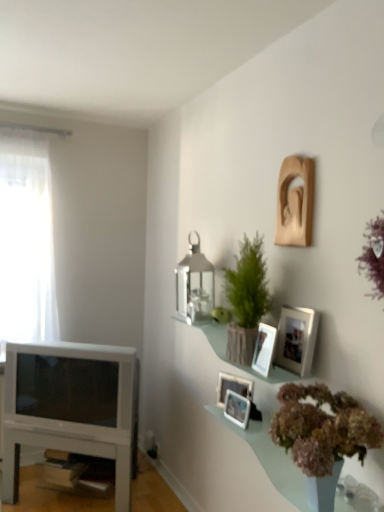
Question: Considering the relative positions of white glossy television at left and wooden sculpture at upper right, the 1th picture frame in the top-to-bottom sequence, in the image provided, is white glossy television at left to the left or to the right of wooden sculpture at upper right, the 1th picture frame in the top-to-bottom sequence,?

Choices:
 (A) right
 (B) left

Answer: (B)

Question: In the image, is white glossy television at left positioned in front of or behind wooden sculpture at upper right, which is the 5th picture frame in bottom-to-top order?

Choices:
 (A) behind
 (B) front

Answer: (A)

Question: Estimate the real-world distances between objects in this image. Which object is closer to the matte silver picture frame at center, positioned as the 5th picture frame in top-to-bottom order?

Choices:
 (A) green textured plant at upper center, the 2th houseplant from the front
 (B) matte silver picture frame at center, which is counted as the second picture frame, starting from the bottom
 (C) matte glass shelf at upper right
 (D) wooden photo frame at upper right, the second picture frame in the top-to-bottom sequence
 (E) white glossy table at lower left

Answer: (B)

Question: Which object is the closest to the matte glass shelf at upper right?

Choices:
 (A) silver metallic lantern at upper center
 (B) white glossy television at left
 (C) matte silver picture frame at center, marked as the 1th picture frame in a bottom-to-top arrangement
 (D) wooden picture frame at upper right, which is the 3th picture frame from bottom to top
 (E) green textured plant at upper center, arranged as the 2th houseplant when ordered from the bottom

Answer: (D)